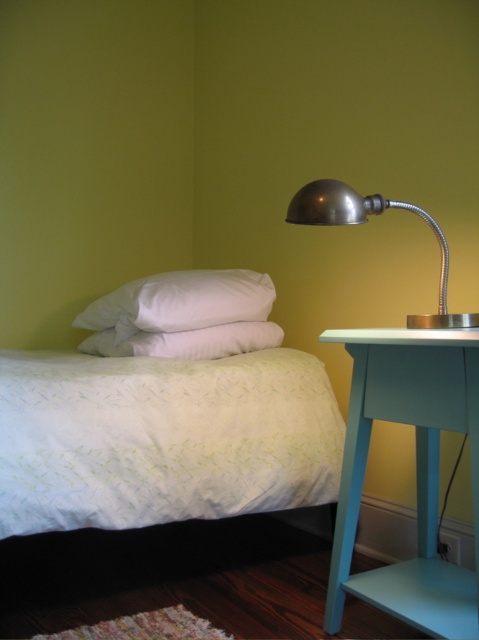
You are organizing a small party in the bedroom and need to place a decorative vase that requires a stable surface. Given the teal painted wood side table at right and the white soft pillow at center, which object would be the most suitable to place the vase on?

The teal painted wood side table at right is more suitable because it has a greater height than the white soft pillow at center, providing a stable and elevated surface for the vase.

You are a photographer setting up a shot of the bedroom corner. You want to ensure the brushed metal desk lamp at right is in focus. If your camera has a depth of field that can sharply capture objects within 1.2 meters from its current position, will the lamp be in focus?

The brushed metal desk lamp at right is 1.24 meters away from the camera. Since the depth of field can only sharply capture objects within 1.2 meters, the lamp is slightly out of the optimal focus range and may appear slightly blurred.